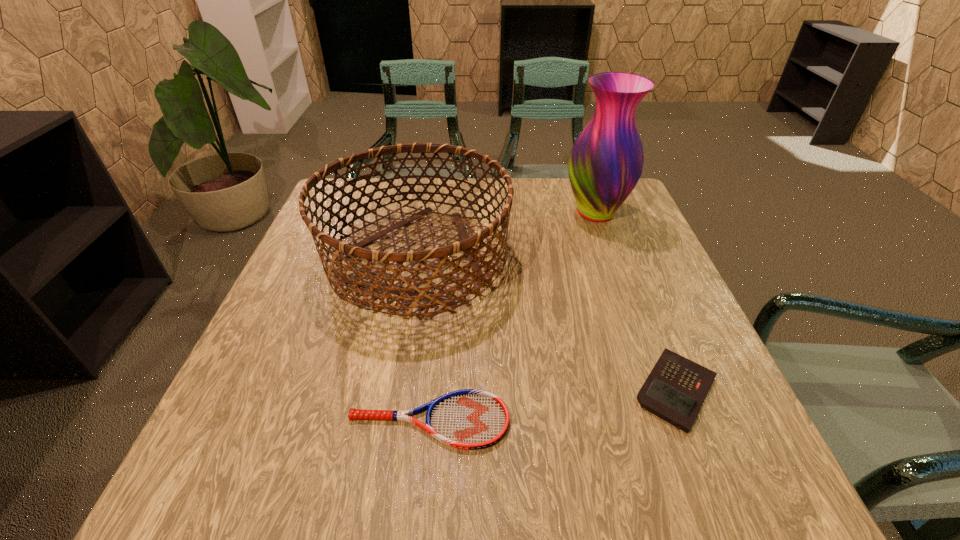
Where is `vase`? The height and width of the screenshot is (540, 960). vase is located at coordinates (606, 161).

You are a GUI agent. You are given a task and a screenshot of the screen. Output one action in this format:
    pyautogui.click(x=<x>, y=<y>)
    Task: Click on the basket
    
    Given the screenshot: What is the action you would take?
    pyautogui.click(x=342, y=250)

At what (x,y) coordinates should I click in order to perform the action: click on the third tallest object. Please return your answer as a coordinate pair (x, y). The height and width of the screenshot is (540, 960). Looking at the image, I should click on (675, 390).

At what (x,y) coordinates should I click in order to perform the action: click on the shortest object. Please return your answer as a coordinate pair (x, y). Image resolution: width=960 pixels, height=540 pixels. Looking at the image, I should click on (470, 419).

At what (x,y) coordinates should I click in order to perform the action: click on vacant area located on the front of the tallest object. Please return your answer as a coordinate pair (x, y). Looking at the image, I should click on (612, 256).

Find the location of a particular element. This screenshot has width=960, height=540. vacant space situated 0.170m on the right of the basket is located at coordinates (581, 259).

Locate an element on the screen. The width and height of the screenshot is (960, 540). free spot located 0.160m on the back of the calculator is located at coordinates (639, 295).

You are a GUI agent. You are given a task and a screenshot of the screen. Output one action in this format:
    pyautogui.click(x=<x>, y=<y>)
    Task: Click on the vacant space located 0.090m on the right of the shortest object
    
    Given the screenshot: What is the action you would take?
    pyautogui.click(x=564, y=421)

You are a GUI agent. You are given a task and a screenshot of the screen. Output one action in this format:
    pyautogui.click(x=<x>, y=<y>)
    Task: Click on the vase located at the far edge
    The height and width of the screenshot is (540, 960).
    Given the screenshot: What is the action you would take?
    pyautogui.click(x=606, y=161)

Find the location of a particular element. This screenshot has height=540, width=960. basket at the far edge is located at coordinates (342, 250).